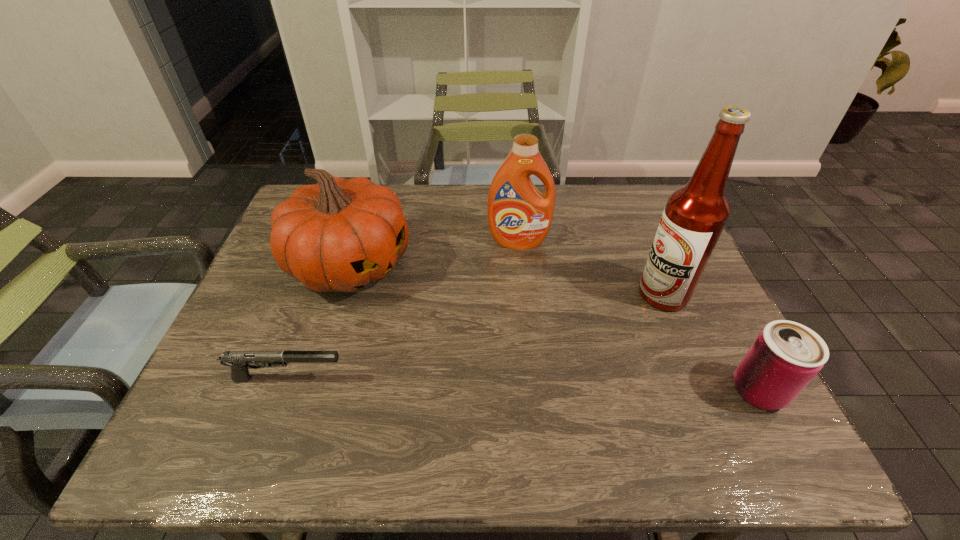
At what (x,y) coordinates should I click in order to perform the action: click on vacant space located 0.310m on the face of the pumpkin. Please return your answer as a coordinate pair (x, y). The height and width of the screenshot is (540, 960). Looking at the image, I should click on (493, 348).

What are the coordinates of `vacant space located on the label side of the tallest object` in the screenshot? It's located at (611, 328).

This screenshot has width=960, height=540. I want to click on free spot located 0.130m on the label side of the tallest object, so click(x=611, y=328).

Where is `vacant space located on the label side of the tallest object`? vacant space located on the label side of the tallest object is located at coordinates (543, 371).

Where is `free spot located on the front-facing side of the third object from left to right`? Image resolution: width=960 pixels, height=540 pixels. free spot located on the front-facing side of the third object from left to right is located at coordinates (527, 346).

What are the coordinates of `vacant position located 0.210m on the front-facing side of the third object from left to right` in the screenshot? It's located at (523, 304).

Identify the location of vacant space located 0.280m on the front-facing side of the third object from left to right. The width and height of the screenshot is (960, 540). (525, 326).

Where is `object at the far edge`? The image size is (960, 540). object at the far edge is located at coordinates 340,234.

Locate an element on the screen. The height and width of the screenshot is (540, 960). gun that is at the near edge is located at coordinates (239, 361).

Locate an element on the screen. The width and height of the screenshot is (960, 540). can located at the near edge is located at coordinates (785, 356).